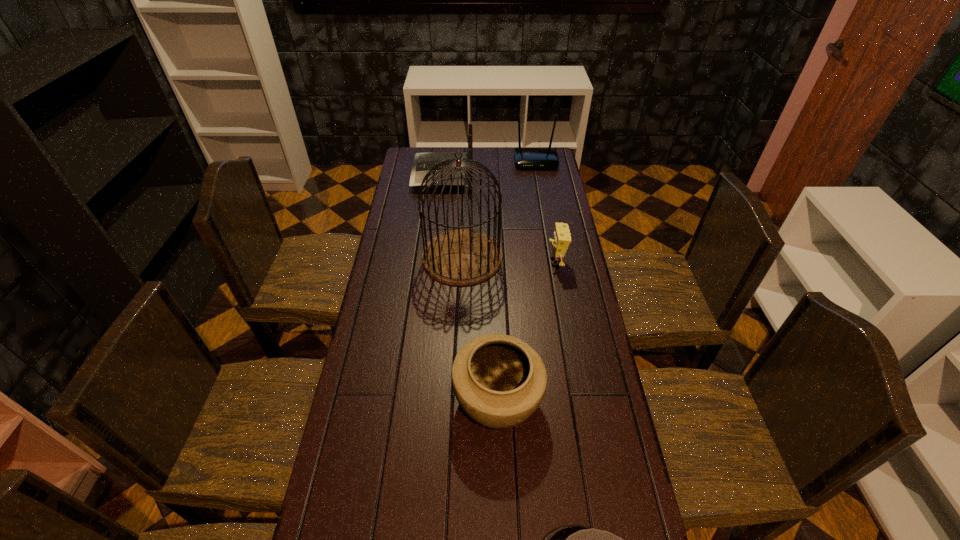
Locate an element on the screen. This screenshot has height=540, width=960. the tallest object is located at coordinates (460, 257).

You are a GUI agent. You are given a task and a screenshot of the screen. Output one action in this format:
    pyautogui.click(x=<x>, y=<y>)
    Task: Click on the left router
    The width and height of the screenshot is (960, 540).
    Given the screenshot: What is the action you would take?
    pyautogui.click(x=423, y=162)

Where is `the right router`? The width and height of the screenshot is (960, 540). the right router is located at coordinates (524, 157).

Where is `pottery`? pottery is located at coordinates (499, 381).

Identify the location of sponge. This screenshot has width=960, height=540. (561, 240).

I want to click on blank area located 0.260m at the door of the tallest object, so click(x=568, y=257).

Where is `blank area located on the front-facing side of the left router`? The width and height of the screenshot is (960, 540). blank area located on the front-facing side of the left router is located at coordinates (403, 175).

I want to click on vacant region located on the front-facing side of the left router, so click(400, 175).

Find the location of a particular element. The width and height of the screenshot is (960, 540). free region located on the front-facing side of the right router is located at coordinates (542, 204).

At what (x,y) coordinates should I click in order to perform the action: click on blank space located on the left of the second nearest object. Please return your answer as a coordinate pair (x, y). Looking at the image, I should click on (420, 400).